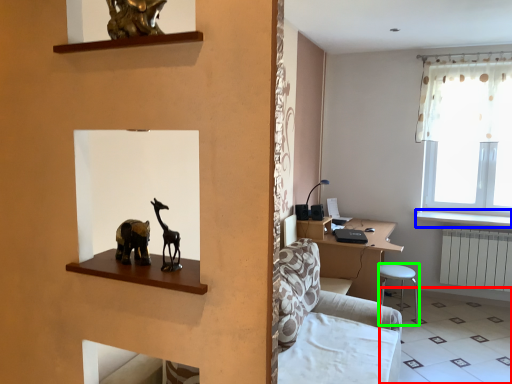
Question: Based on their relative distances, which object is farther from tile (highlighted by a red box)? Choose from window sill (highlighted by a blue box) and bar stool (highlighted by a green box).

Choices:
 (A) window sill
 (B) bar stool

Answer: (A)